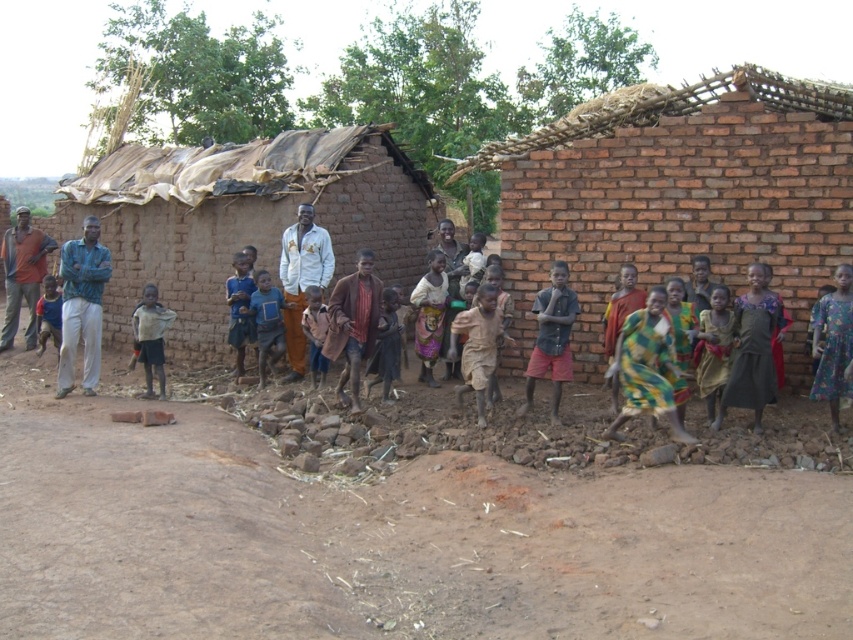
Question: Considering the real-world distances, which object is farthest from the green textured dress at center?

Choices:
 (A) light brown fabric shirt at center
 (B) green and yellow fabric dress at center
 (C) green fabric shirt at left
 (D) brown mud hut at center

Answer: (D)

Question: Considering the relative positions of brown mud hut at center and light brown fabric shirt at center in the image provided, where is brown mud hut at center located with respect to light brown fabric shirt at center?

Choices:
 (A) above
 (B) below

Answer: (A)

Question: Which point appears closest to the camera in this image?

Choices:
 (A) (13, 237)
 (B) (144, 344)
 (C) (82, 321)

Answer: (C)

Question: Which point appears farthest from the camera in this image?

Choices:
 (A) (65, 308)
 (B) (643, 406)
 (C) (120, 502)
 (D) (10, 278)

Answer: (D)

Question: Does brown dirt field at center have a lesser width compared to brown mud hut at center?

Choices:
 (A) no
 (B) yes

Answer: (B)

Question: Does brown mud hut at center appear on the left side of brown fabric shirt at left?

Choices:
 (A) yes
 (B) no

Answer: (B)